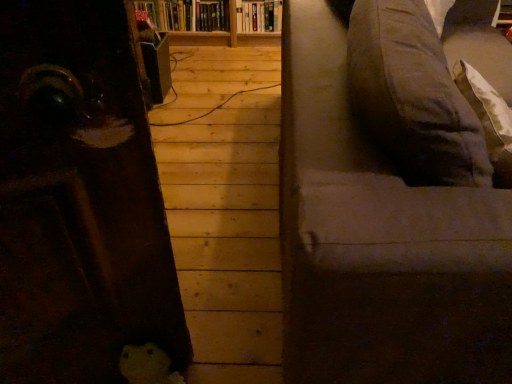
Question: Is dark gray fabric couch at right not within hardcover book at upper center, which is the first book from left to right?

Choices:
 (A) yes
 (B) no

Answer: (A)

Question: Can you confirm if dark gray fabric couch at right is bigger than hardcover book at upper center, which is the first book from left to right?

Choices:
 (A) no
 (B) yes

Answer: (B)

Question: Is dark gray fabric couch at right positioned far away from hardcover book at upper center, which is the first book from left to right?

Choices:
 (A) no
 (B) yes

Answer: (B)

Question: Does dark gray fabric couch at right have a greater width compared to hardcover book at upper center, which is the second book from right to left?

Choices:
 (A) yes
 (B) no

Answer: (A)

Question: Considering the relative sizes of dark gray fabric couch at right and hardcover book at upper center, which is the second book from right to left, in the image provided, is dark gray fabric couch at right smaller than hardcover book at upper center, which is the second book from right to left,?

Choices:
 (A) no
 (B) yes

Answer: (A)

Question: In terms of height, does dark gray fabric couch at right look taller or shorter compared to hardcover book at upper center, which is the first book from left to right?

Choices:
 (A) short
 (B) tall

Answer: (B)

Question: In terms of size, does dark gray fabric couch at right appear bigger or smaller than hardcover book at upper center, which is the second book from right to left?

Choices:
 (A) big
 (B) small

Answer: (A)

Question: Is dark gray fabric couch at right spatially inside hardcover book at upper center, which is the second book from right to left, or outside of it?

Choices:
 (A) outside
 (B) inside

Answer: (A)

Question: Considering the positions of point (406, 349) and point (193, 31), is point (406, 349) closer or farther from the camera than point (193, 31)?

Choices:
 (A) farther
 (B) closer

Answer: (B)

Question: From the image's perspective, is hardcover book at upper center, which is the 1th book from right to left, above or below hardcover book at upper center, which is the second book from right to left?

Choices:
 (A) above
 (B) below

Answer: (B)

Question: Is hardcover book at upper center, positioned as the 2th book in left-to-right order, taller or shorter than hardcover book at upper center, which is the second book from right to left?

Choices:
 (A) tall
 (B) short

Answer: (B)

Question: Considering their positions, is hardcover book at upper center, which is the 1th book from right to left, located in front of or behind hardcover book at upper center, which is the first book from left to right?

Choices:
 (A) front
 (B) behind

Answer: (A)

Question: Does point (269, 14) appear closer or farther from the camera than point (205, 23)?

Choices:
 (A) farther
 (B) closer

Answer: (B)

Question: From a real-world perspective, relative to hardcover book at upper center, positioned as the 2th book in left-to-right order, is hardcover book at upper center, which is the first book from left to right, vertically above or below?

Choices:
 (A) below
 (B) above

Answer: (B)

Question: Which is correct: hardcover book at upper center, which is the second book from right to left, is inside hardcover book at upper center, positioned as the 2th book in left-to-right order, or outside of it?

Choices:
 (A) inside
 (B) outside

Answer: (B)